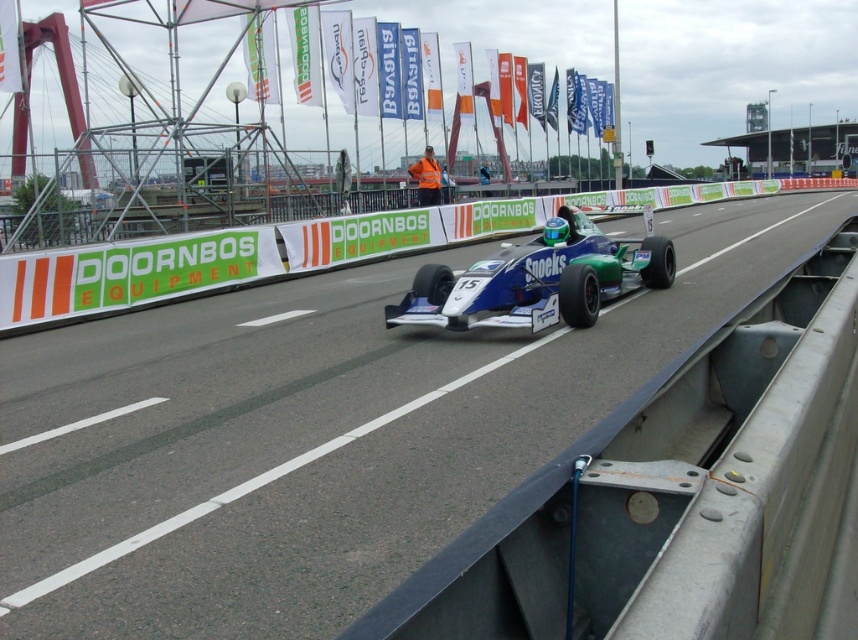
Question: From the image, what is the correct spatial relationship of smooth asphalt road at center in relation to blue glossy race car at center?

Choices:
 (A) above
 (B) below

Answer: (B)

Question: Which point appears farthest from the camera in this image?

Choices:
 (A) (547, 284)
 (B) (307, 356)

Answer: (A)

Question: From the image, what is the correct spatial relationship of smooth asphalt road at center in relation to blue glossy race car at center?

Choices:
 (A) left
 (B) right

Answer: (A)

Question: Does smooth asphalt road at center have a larger size compared to blue glossy race car at center?

Choices:
 (A) yes
 (B) no

Answer: (A)

Question: Among these objects, which one is nearest to the camera?

Choices:
 (A) blue glossy race car at center
 (B) smooth asphalt road at center

Answer: (B)